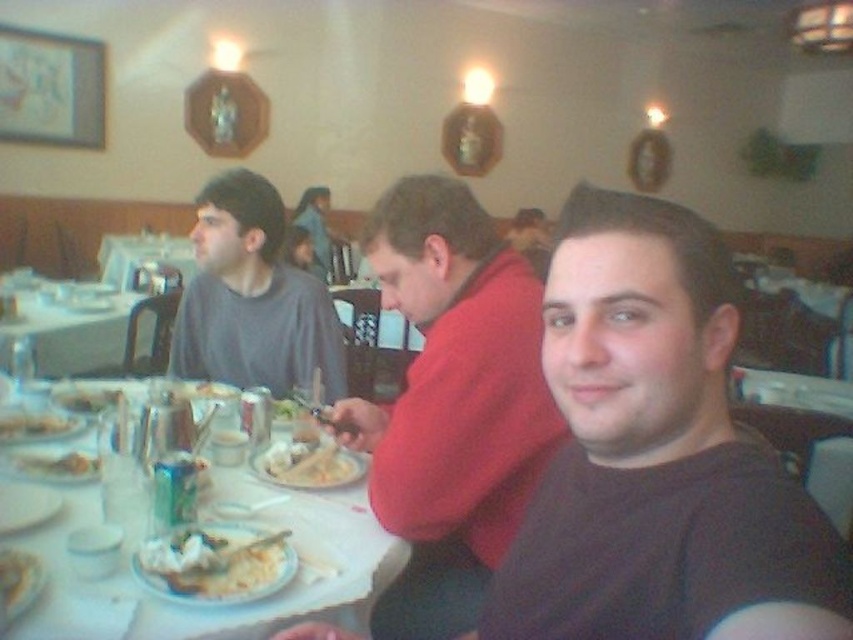
You are a waiter trying to clear the table. The customer has finished eating the white creamy pasta at center and left the white paper plate at table left. Which item should you pick up first to efficiently clear the table?

A: You should pick up the white paper plate at table left first because it is behind the white creamy pasta at center, so removing it first will prevent disturbing the remaining items on the table.

You are a waiter trying to place a new dish on the table. The dish is slightly larger than the white creamy pasta at center. Can you fit it next to the dark brown shirt at center without moving any existing items?

The dark brown shirt at center is larger in size than the white creamy pasta at center. Since the new dish is only slightly larger than the pasta, it should be smaller than the shirt. Therefore, there might be enough space next to the dark brown shirt at center to accommodate it without moving other items, but this depends on the exact dimensions and arrangement of existing objects.